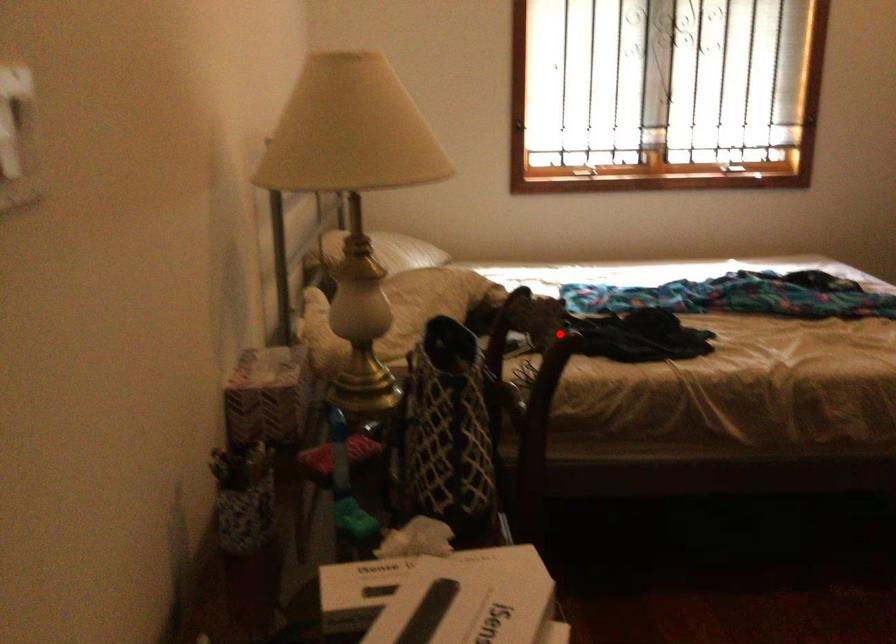
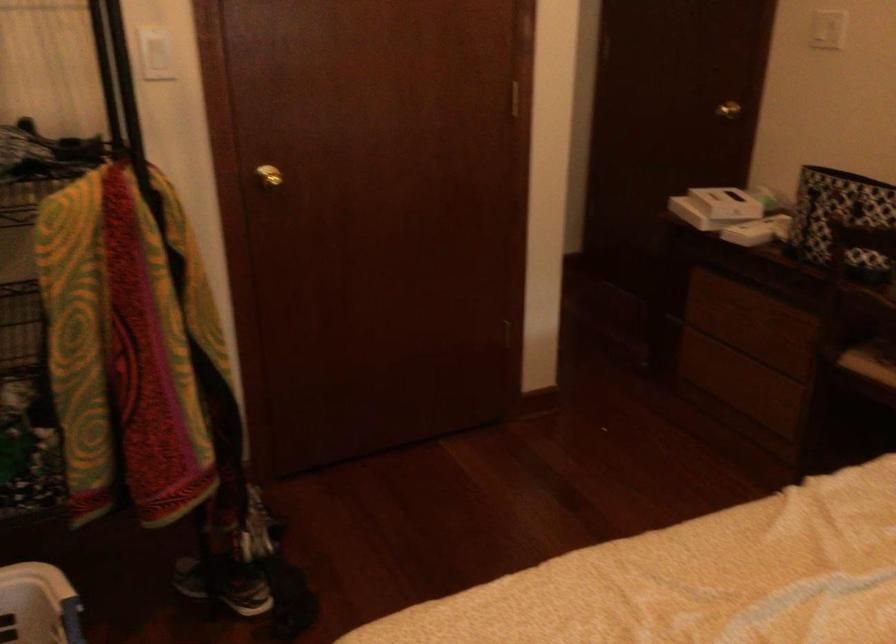
Question: I am providing you with two images of the same scene from different viewpoints. In image1, a red point is highlighted. Considering the same 3D point in image2, which of the following is correct?

Choices:
 (A) It is closer
 (B) It is farther

Answer: (B)